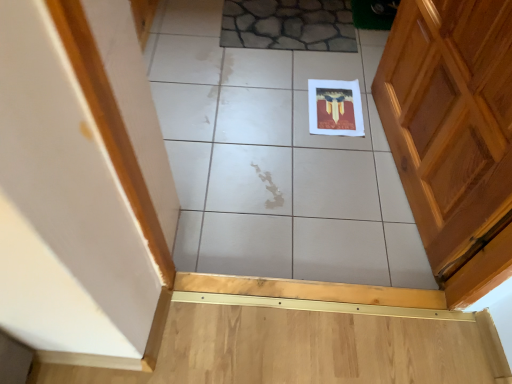
Image resolution: width=512 pixels, height=384 pixels. Identify the location of white glossy tile at center, which is counted as the 2th ceramic tile, starting from the top. (276, 161).

Describe the element at coordinates (276, 161) in the screenshot. I see `white glossy tile at center, placed as the 1th ceramic tile when sorted from bottom to top` at that location.

The width and height of the screenshot is (512, 384). What do you see at coordinates (289, 25) in the screenshot?
I see `stone-like ceramic tile at upper center, the 1th ceramic tile from the top` at bounding box center [289, 25].

Identify the location of stone-like ceramic tile at upper center, positioned as the 2th ceramic tile in bottom-to-top order. (x=289, y=25).

I want to click on white glossy tile at center, placed as the 1th ceramic tile when sorted from bottom to top, so click(276, 161).

Visually, is stone-like ceramic tile at upper center, positioned as the 2th ceramic tile in bottom-to-top order, positioned to the left or to the right of white glossy tile at center, which is counted as the 2th ceramic tile, starting from the top?

In the image, stone-like ceramic tile at upper center, positioned as the 2th ceramic tile in bottom-to-top order, appears on the left side of white glossy tile at center, which is counted as the 2th ceramic tile, starting from the top.

Between stone-like ceramic tile at upper center, the 1th ceramic tile from the top, and white glossy tile at center, placed as the 1th ceramic tile when sorted from bottom to top, which one is positioned in front?

white glossy tile at center, placed as the 1th ceramic tile when sorted from bottom to top.

Does point (246, 43) come in front of point (256, 261)?

No.

From the image's perspective, which is below, stone-like ceramic tile at upper center, the 1th ceramic tile from the top, or white glossy tile at center, which is counted as the 2th ceramic tile, starting from the top?

From the image's view, white glossy tile at center, which is counted as the 2th ceramic tile, starting from the top, is below.

From a real-world perspective, which is physically above, stone-like ceramic tile at upper center, the 1th ceramic tile from the top, or white glossy tile at center, which is counted as the 2th ceramic tile, starting from the top?

In real-world perspective, stone-like ceramic tile at upper center, the 1th ceramic tile from the top, is above.

Which object is thinner, stone-like ceramic tile at upper center, the 1th ceramic tile from the top, or white glossy tile at center, placed as the 1th ceramic tile when sorted from bottom to top?

stone-like ceramic tile at upper center, the 1th ceramic tile from the top, is thinner.

Which of these two, stone-like ceramic tile at upper center, positioned as the 2th ceramic tile in bottom-to-top order, or white glossy tile at center, placed as the 1th ceramic tile when sorted from bottom to top, stands taller?

Standing taller between the two is white glossy tile at center, placed as the 1th ceramic tile when sorted from bottom to top.

In terms of size, does stone-like ceramic tile at upper center, the 1th ceramic tile from the top, appear bigger or smaller than white glossy tile at center, which is counted as the 2th ceramic tile, starting from the top?

In the image, stone-like ceramic tile at upper center, the 1th ceramic tile from the top, appears to be smaller than white glossy tile at center, which is counted as the 2th ceramic tile, starting from the top.

Is white glossy tile at center, which is counted as the 2th ceramic tile, starting from the top, inside stone-like ceramic tile at upper center, positioned as the 2th ceramic tile in bottom-to-top order?

No, white glossy tile at center, which is counted as the 2th ceramic tile, starting from the top, is not inside stone-like ceramic tile at upper center, positioned as the 2th ceramic tile in bottom-to-top order.

Would you consider stone-like ceramic tile at upper center, the 1th ceramic tile from the top, to be distant from white glossy tile at center, placed as the 1th ceramic tile when sorted from bottom to top?

No, stone-like ceramic tile at upper center, the 1th ceramic tile from the top, is in close proximity to white glossy tile at center, placed as the 1th ceramic tile when sorted from bottom to top.

Could you tell me if stone-like ceramic tile at upper center, positioned as the 2th ceramic tile in bottom-to-top order, is turned towards white glossy tile at center, placed as the 1th ceramic tile when sorted from bottom to top?

Yes, stone-like ceramic tile at upper center, positioned as the 2th ceramic tile in bottom-to-top order, is facing white glossy tile at center, placed as the 1th ceramic tile when sorted from bottom to top.

Could you measure the distance between stone-like ceramic tile at upper center, positioned as the 2th ceramic tile in bottom-to-top order, and white glossy tile at center, which is counted as the 2th ceramic tile, starting from the top?

16.63 inches.

Where is `ceramic tile behind the white glossy tile at center, placed as the 1th ceramic tile when sorted from bottom to top`? ceramic tile behind the white glossy tile at center, placed as the 1th ceramic tile when sorted from bottom to top is located at coordinates (289, 25).

Which is more to the left, white glossy tile at center, which is counted as the 2th ceramic tile, starting from the top, or stone-like ceramic tile at upper center, the 1th ceramic tile from the top?

Positioned to the left is stone-like ceramic tile at upper center, the 1th ceramic tile from the top.

Between white glossy tile at center, placed as the 1th ceramic tile when sorted from bottom to top, and stone-like ceramic tile at upper center, positioned as the 2th ceramic tile in bottom-to-top order, which one is positioned in front?

Positioned in front is white glossy tile at center, placed as the 1th ceramic tile when sorted from bottom to top.

Is point (191, 214) closer or farther from the camera than point (332, 8)?

Point (191, 214) is closer to the camera than point (332, 8).

From the image's perspective, is white glossy tile at center, which is counted as the 2th ceramic tile, starting from the top, above or below stone-like ceramic tile at upper center, positioned as the 2th ceramic tile in bottom-to-top order?

Based on their image positions, white glossy tile at center, which is counted as the 2th ceramic tile, starting from the top, is located beneath stone-like ceramic tile at upper center, positioned as the 2th ceramic tile in bottom-to-top order.

From a real-world perspective, is white glossy tile at center, placed as the 1th ceramic tile when sorted from bottom to top, physically below stone-like ceramic tile at upper center, positioned as the 2th ceramic tile in bottom-to-top order?

Yes, from a real-world perspective, white glossy tile at center, placed as the 1th ceramic tile when sorted from bottom to top, is below stone-like ceramic tile at upper center, positioned as the 2th ceramic tile in bottom-to-top order.

Between white glossy tile at center, placed as the 1th ceramic tile when sorted from bottom to top, and stone-like ceramic tile at upper center, the 1th ceramic tile from the top, which one has larger width?

white glossy tile at center, placed as the 1th ceramic tile when sorted from bottom to top, is wider.

Can you confirm if white glossy tile at center, placed as the 1th ceramic tile when sorted from bottom to top, is taller than stone-like ceramic tile at upper center, the 1th ceramic tile from the top?

Correct, white glossy tile at center, placed as the 1th ceramic tile when sorted from bottom to top, is much taller as stone-like ceramic tile at upper center, the 1th ceramic tile from the top.

Considering the sizes of objects white glossy tile at center, placed as the 1th ceramic tile when sorted from bottom to top, and stone-like ceramic tile at upper center, positioned as the 2th ceramic tile in bottom-to-top order, in the image provided, who is bigger, white glossy tile at center, placed as the 1th ceramic tile when sorted from bottom to top, or stone-like ceramic tile at upper center, positioned as the 2th ceramic tile in bottom-to-top order,?

With larger size is white glossy tile at center, placed as the 1th ceramic tile when sorted from bottom to top.

Is white glossy tile at center, placed as the 1th ceramic tile when sorted from bottom to top, inside or outside of stone-like ceramic tile at upper center, the 1th ceramic tile from the top?

white glossy tile at center, placed as the 1th ceramic tile when sorted from bottom to top, lies outside stone-like ceramic tile at upper center, the 1th ceramic tile from the top.

Is white glossy tile at center, placed as the 1th ceramic tile when sorted from bottom to top, not close to stone-like ceramic tile at upper center, the 1th ceramic tile from the top?

No.

Is white glossy tile at center, placed as the 1th ceramic tile when sorted from bottom to top, facing away from stone-like ceramic tile at upper center, positioned as the 2th ceramic tile in bottom-to-top order?

Yes, white glossy tile at center, placed as the 1th ceramic tile when sorted from bottom to top, is facing away from stone-like ceramic tile at upper center, positioned as the 2th ceramic tile in bottom-to-top order.

Measure the distance from white glossy tile at center, which is counted as the 2th ceramic tile, starting from the top, to stone-like ceramic tile at upper center, the 1th ceramic tile from the top.

42.23 centimeters.

Where is `ceramic tile lying below the stone-like ceramic tile at upper center, the 1th ceramic tile from the top (from the image's perspective)`? The width and height of the screenshot is (512, 384). ceramic tile lying below the stone-like ceramic tile at upper center, the 1th ceramic tile from the top (from the image's perspective) is located at coordinates click(x=276, y=161).

The width and height of the screenshot is (512, 384). Find the location of `ceramic tile above the white glossy tile at center, which is counted as the 2th ceramic tile, starting from the top (from a real-world perspective)`. ceramic tile above the white glossy tile at center, which is counted as the 2th ceramic tile, starting from the top (from a real-world perspective) is located at coordinates (289, 25).

In the image, there is a stone-like ceramic tile at upper center, positioned as the 2th ceramic tile in bottom-to-top order. Identify the location of ceramic tile below it (from a real-world perspective). (276, 161).